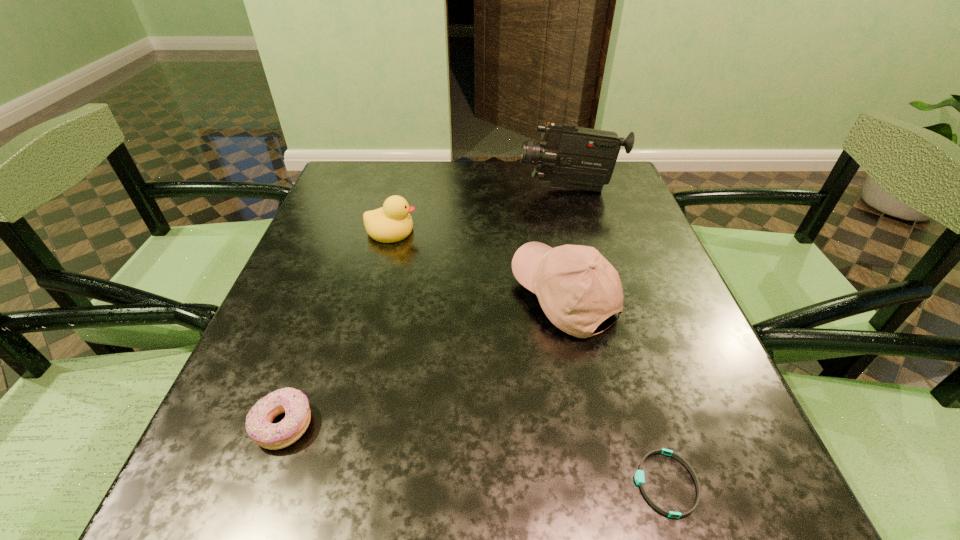
Find the location of `object present at the near edge`. object present at the near edge is located at coordinates (639, 476).

Where is `duckling that is at the left edge`? The width and height of the screenshot is (960, 540). duckling that is at the left edge is located at coordinates tap(391, 223).

The width and height of the screenshot is (960, 540). I want to click on doughnut at the left edge, so click(x=295, y=404).

Locate an element on the screen. The height and width of the screenshot is (540, 960). camcorder at the right edge is located at coordinates (572, 157).

This screenshot has height=540, width=960. I want to click on baseball cap at the right edge, so click(x=577, y=288).

Where is `wristband at the right edge`? The height and width of the screenshot is (540, 960). wristband at the right edge is located at coordinates (639, 476).

What are the coordinates of `object that is at the far right corner` in the screenshot? It's located at (572, 157).

You are a GUI agent. You are given a task and a screenshot of the screen. Output one action in this format:
    pyautogui.click(x=<x>, y=<y>)
    Task: Click on the object positioned at the near right corner
    
    Given the screenshot: What is the action you would take?
    pyautogui.click(x=639, y=476)

Locate an element on the screen. blank space at the far edge of the desktop is located at coordinates (443, 174).

In the image, there is a desktop. Identify the location of free space at the near edge. (392, 471).